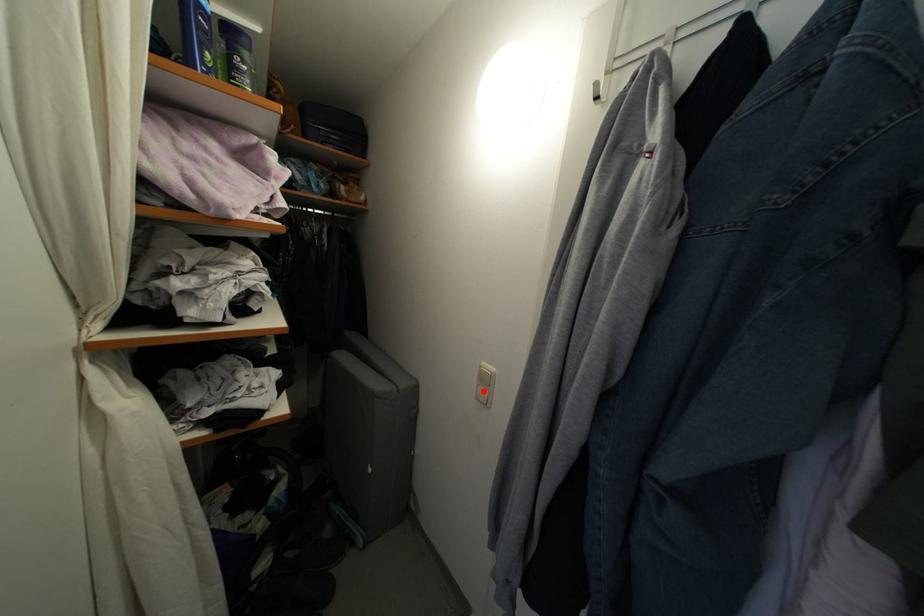
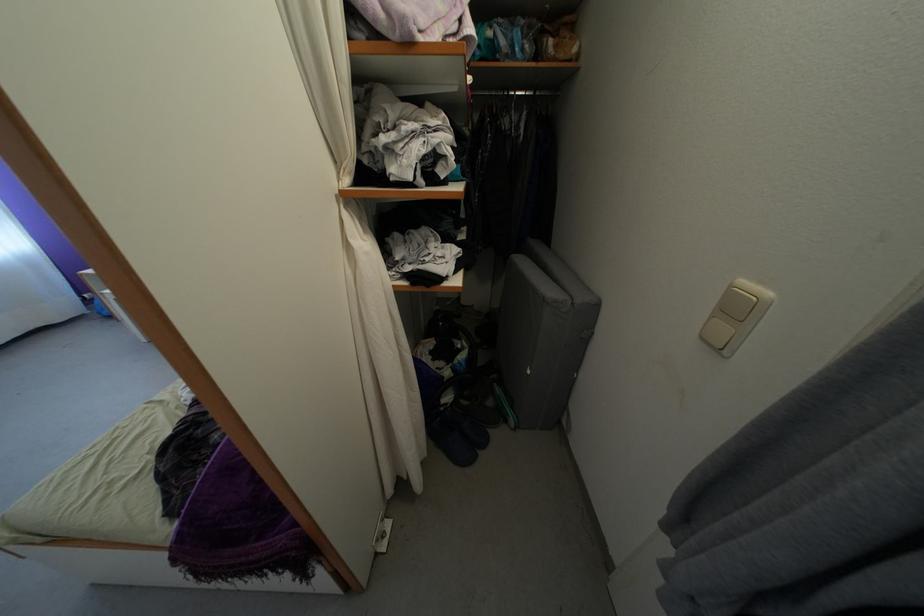
The point at the highlighted location is marked in the first image. Where is the corresponding point in the second image?

(718, 323)